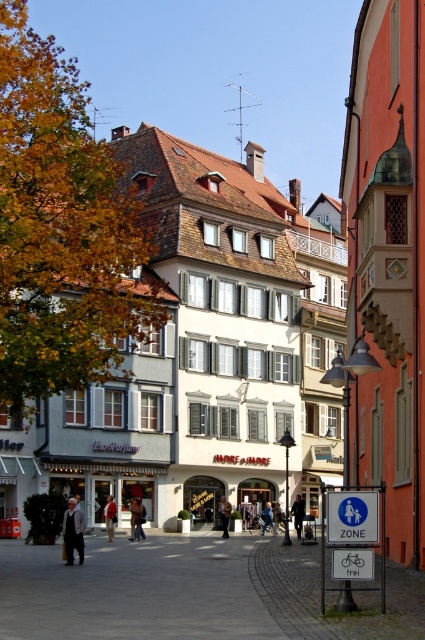
Does dark gray jacket at center appear on the left side of dark gray suit at center?

Correct, you'll find dark gray jacket at center to the left of dark gray suit at center.

Which is behind, point (138, 502) or point (303, 512)?

Positioned behind is point (303, 512).

This screenshot has width=425, height=640. Describe the element at coordinates (136, 518) in the screenshot. I see `dark gray jacket at center` at that location.

I want to click on dark gray jacket at center, so click(x=136, y=518).

Can you confirm if light gray fabric jacket at lower left is bigger than dark gray suit at center?

No.

The height and width of the screenshot is (640, 425). Describe the element at coordinates (73, 531) in the screenshot. I see `light gray fabric jacket at lower left` at that location.

Between point (67, 556) and point (300, 508), which one is positioned behind?

Point (300, 508)

This screenshot has width=425, height=640. Find the location of `light gray fabric jacket at lower left`. light gray fabric jacket at lower left is located at coordinates (73, 531).

Does light gray fabric jacket at lower left have a greater width compared to red leather jacket at center?

Yes.

You are a GUI agent. You are given a task and a screenshot of the screen. Output one action in this format:
    pyautogui.click(x=<x>, y=<y>)
    Task: Click on the light gray fabric jacket at lower left
    This screenshot has height=640, width=425.
    Given the screenshot: What is the action you would take?
    pyautogui.click(x=73, y=531)

Identify the location of light gray fabric jacket at lower left. The height and width of the screenshot is (640, 425). (73, 531).